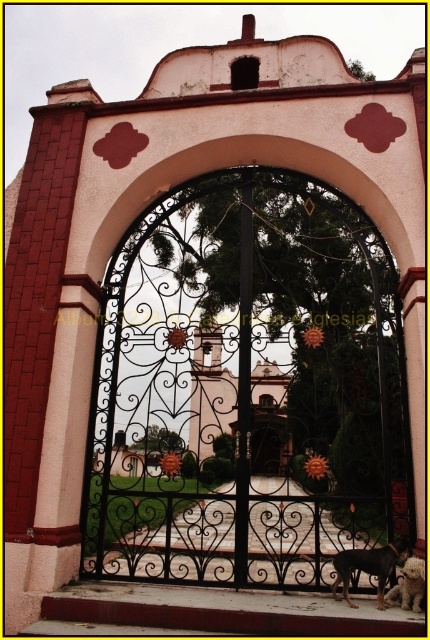
Question: Estimate the real-world distances between objects in this image. Which object is farther from the brown fur dog at center?

Choices:
 (A) black wrought iron gate at center
 (B) white fluffy dog at lower right

Answer: (A)

Question: Which object is closer to the camera taking this photo?

Choices:
 (A) brown fur dog at center
 (B) black wrought iron gate at center
 (C) white fluffy dog at lower right

Answer: (C)

Question: Among these objects, which one is farthest from the camera?

Choices:
 (A) black wrought iron gate at center
 (B) white fluffy dog at lower right

Answer: (A)

Question: Can you confirm if brown fur dog at center is thinner than white fluffy dog at lower right?

Choices:
 (A) no
 (B) yes

Answer: (A)

Question: Can you confirm if brown fur dog at center is positioned to the right of white fluffy dog at lower right?

Choices:
 (A) yes
 (B) no

Answer: (B)

Question: Is black wrought iron gate at center bigger than white fluffy dog at lower right?

Choices:
 (A) yes
 (B) no

Answer: (A)